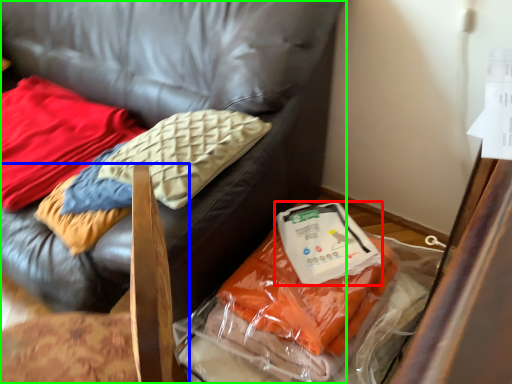
Question: Which object is the closest to the kit (highlighted by a red box)? Choose among these: furniture (highlighted by a blue box) or furniture (highlighted by a green box).

Choices:
 (A) furniture
 (B) furniture

Answer: (B)